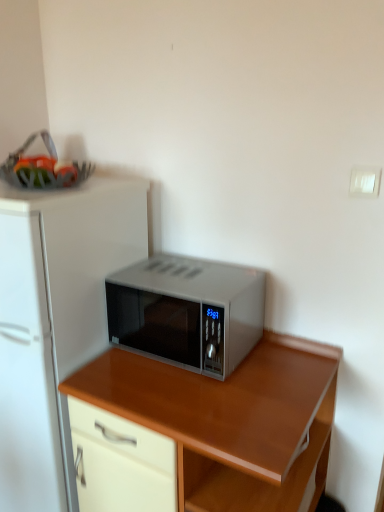
Question: Is white matte refrigerator at center to the left or to the right of wooden desk at center in the image?

Choices:
 (A) right
 (B) left

Answer: (B)

Question: Is white matte refrigerator at center wider or thinner than wooden desk at center?

Choices:
 (A) wide
 (B) thin

Answer: (A)

Question: Based on their relative distances, which object is nearer to the wooden desk at center?

Choices:
 (A) satin silver microwave at center
 (B) white matte refrigerator at center

Answer: (A)

Question: Based on their relative distances, which object is nearer to the wooden desk at center?

Choices:
 (A) satin silver microwave at center
 (B) white matte refrigerator at center

Answer: (A)